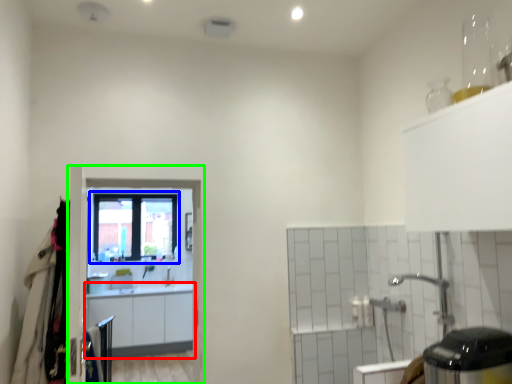
Question: Which is nearer to the cabinetry (highlighted by a red box)? window (highlighted by a blue box) or screen door (highlighted by a green box).

Choices:
 (A) window
 (B) screen door

Answer: (A)